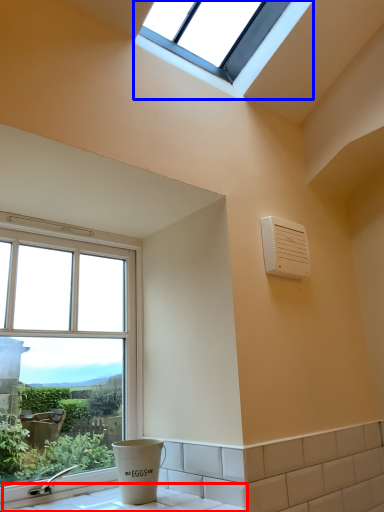
Question: Which point is closer to the camera, counter top (highlighted by a red box) or window (highlighted by a blue box)?

Choices:
 (A) counter top
 (B) window

Answer: (A)